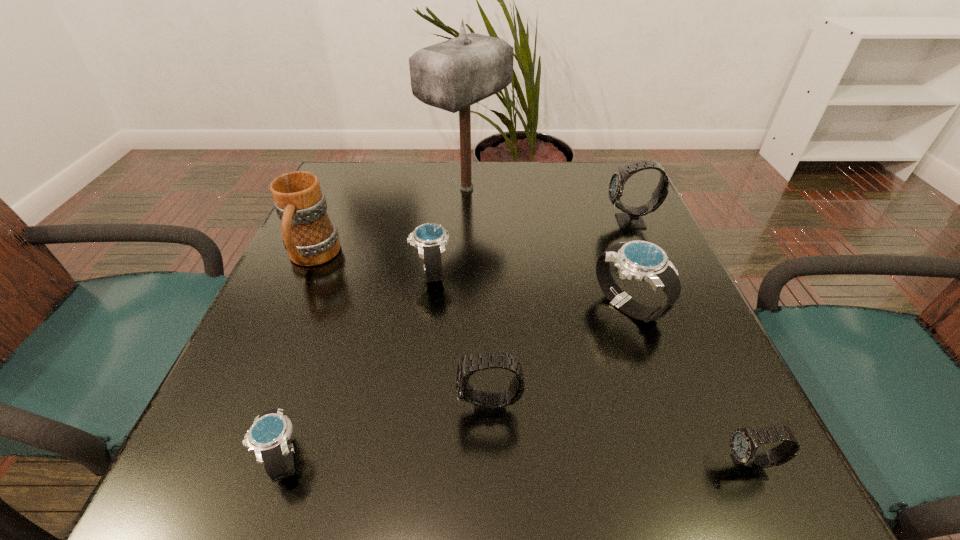
At what (x,y) coordinates should I click in order to perform the action: click on object situated at the near right corner. Please return your answer as a coordinate pair (x, y). The height and width of the screenshot is (540, 960). Looking at the image, I should click on (744, 442).

The image size is (960, 540). I want to click on free location at the far edge, so click(x=513, y=164).

In the image, there is a desktop. Where is `vacant space at the near edge`? vacant space at the near edge is located at coordinates (616, 492).

Identify the location of blank space at the left edge. This screenshot has height=540, width=960. (271, 328).

Image resolution: width=960 pixels, height=540 pixels. I want to click on vacant space at the right edge of the desktop, so click(606, 212).

In the image, there is a desktop. Identify the location of free space at the far left corner. (357, 176).

Locate an element on the screen. free space between the tallest object and the rightmost silver watch is located at coordinates (547, 247).

What are the coordinates of `free area in between the nearest gray watch and the biggest silver watch` in the screenshot? It's located at (688, 387).

Find the location of a particular element. The image size is (960, 540). free space between the rightmost silver watch and the fourth watch from right to left is located at coordinates (559, 358).

At what (x,y) coordinates should I click in order to perform the action: click on vacant area that lies between the sixth farthest object and the second silver watch from right to left. Please return your answer as a coordinate pair (x, y). Looking at the image, I should click on (460, 341).